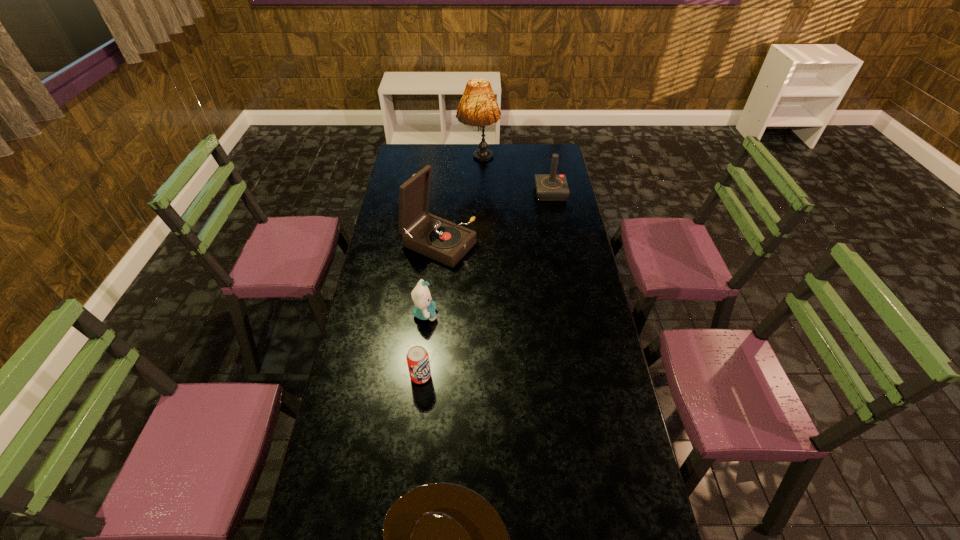
Where is `vacant space located 0.170m on the rectangular base of the rightmost object`? The height and width of the screenshot is (540, 960). vacant space located 0.170m on the rectangular base of the rightmost object is located at coordinates click(x=501, y=193).

Find the location of `free space located on the rectangular base of the rightmost object`. free space located on the rectangular base of the rightmost object is located at coordinates (521, 193).

This screenshot has height=540, width=960. Find the location of `free space located 0.210m on the rectangular base of the rightmost object`. free space located 0.210m on the rectangular base of the rightmost object is located at coordinates (492, 193).

Find the location of a particular element. Image resolution: width=960 pixels, height=540 pixels. free region located on the face of the third nearest object is located at coordinates 504,314.

The height and width of the screenshot is (540, 960). Find the location of `vacant position located 0.170m on the left of the soda can`. vacant position located 0.170m on the left of the soda can is located at coordinates (359, 376).

Locate an element on the screen. The image size is (960, 540). object that is at the far edge is located at coordinates (478, 107).

You are a GUI agent. You are given a task and a screenshot of the screen. Output one action in this format:
    pyautogui.click(x=<x>, y=<y>)
    Task: Click on the object present at the left edge
    This screenshot has width=960, height=540.
    Given the screenshot: What is the action you would take?
    pyautogui.click(x=439, y=239)

The image size is (960, 540). Identify the location of object located in the right edge section of the desktop. (549, 187).

The height and width of the screenshot is (540, 960). In the image, there is a desktop. Find the location of `vacant space at the far edge`. vacant space at the far edge is located at coordinates (528, 152).

This screenshot has height=540, width=960. In order to click on blank space at the left edge of the desktop in this screenshot , I will do `click(369, 423)`.